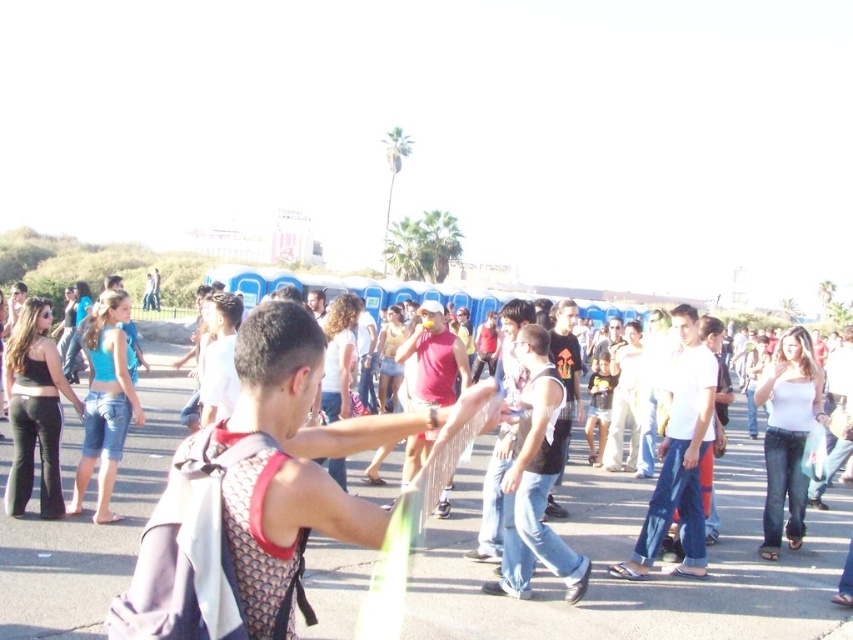
Measure the distance between matte red tank top at center and dark gray t-shirt at center.

A distance of 4.84 feet exists between matte red tank top at center and dark gray t-shirt at center.

Measure the distance between matte red tank top at center and camera.

8.18 meters

Which is behind, point (433, 401) or point (566, 460)?

Point (433, 401)

Identify the location of matte red tank top at center. (434, 358).

Which of these two, dark gray tank top at center or white cotton shirt at center, stands shorter?

dark gray tank top at center is shorter.

Does dark gray tank top at center have a lesser width compared to white cotton shirt at center?

Indeed, dark gray tank top at center has a lesser width compared to white cotton shirt at center.

Does point (544, 349) come in front of point (698, 534)?

Yes, point (544, 349) is closer to viewer.

Identify the location of dark gray tank top at center. (535, 480).

Can you confirm if mesh fabric tank top at center is positioned to the right of matte red tank top at center?

No, mesh fabric tank top at center is not to the right of matte red tank top at center.

Between point (215, 580) and point (427, 369), which one is positioned in front?

Point (215, 580) is more forward.

Which is in front, point (369, 422) or point (430, 321)?

Point (369, 422)

Image resolution: width=853 pixels, height=640 pixels. What are the coordinates of `mesh fabric tank top at center` in the screenshot? It's located at (260, 496).